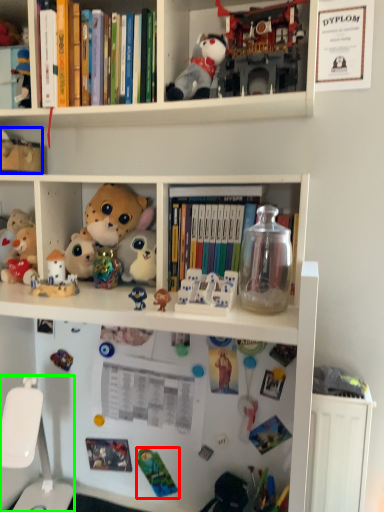
Question: Estimate the real-world distances between objects in this image. Which object is farther from toy (highlighted by a red box), toy (highlighted by a blue box) or swivel chair (highlighted by a green box)?

Choices:
 (A) toy
 (B) swivel chair

Answer: (A)